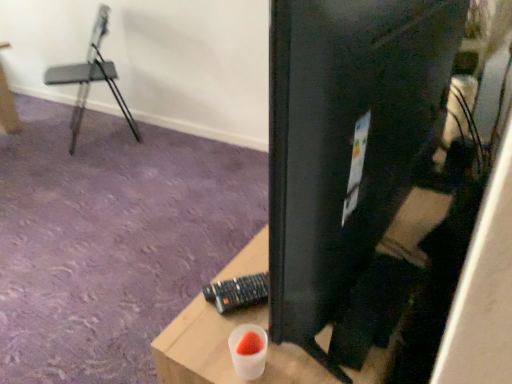
At what (x,y) coordinates should I click in order to perform the action: click on vacant space to the right of metallic gray armchair at left. Please return your answer as a coordinate pair (x, y). The height and width of the screenshot is (384, 512). Looking at the image, I should click on (155, 139).